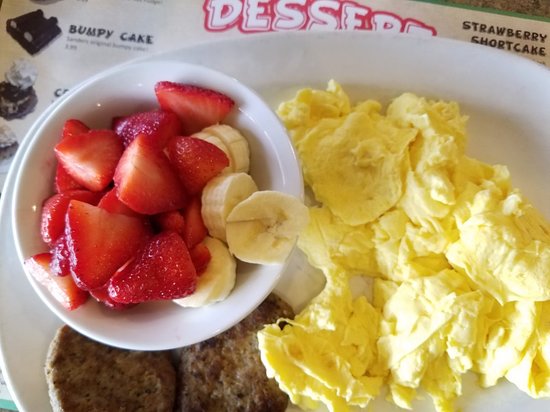
The height and width of the screenshot is (412, 550). Identify the location of dish. (286, 142).